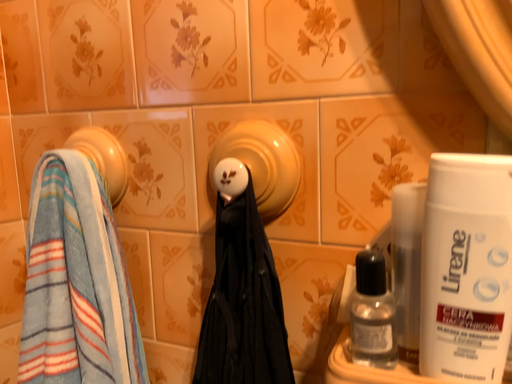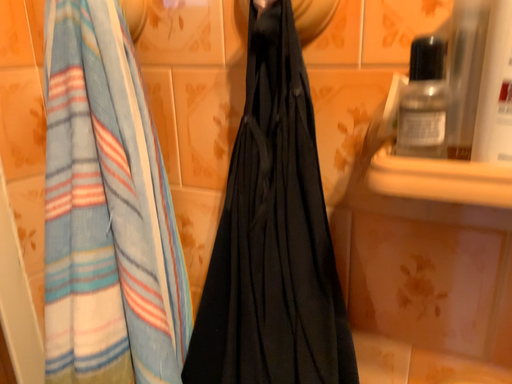
Question: Which way did the camera rotate in the video?

Choices:
 (A) rotated downward
 (B) rotated upward

Answer: (A)